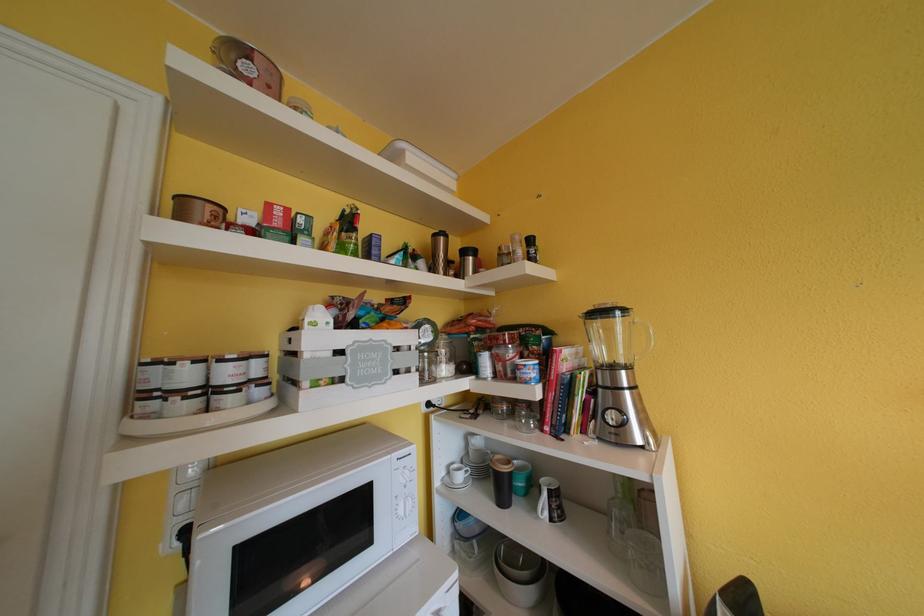
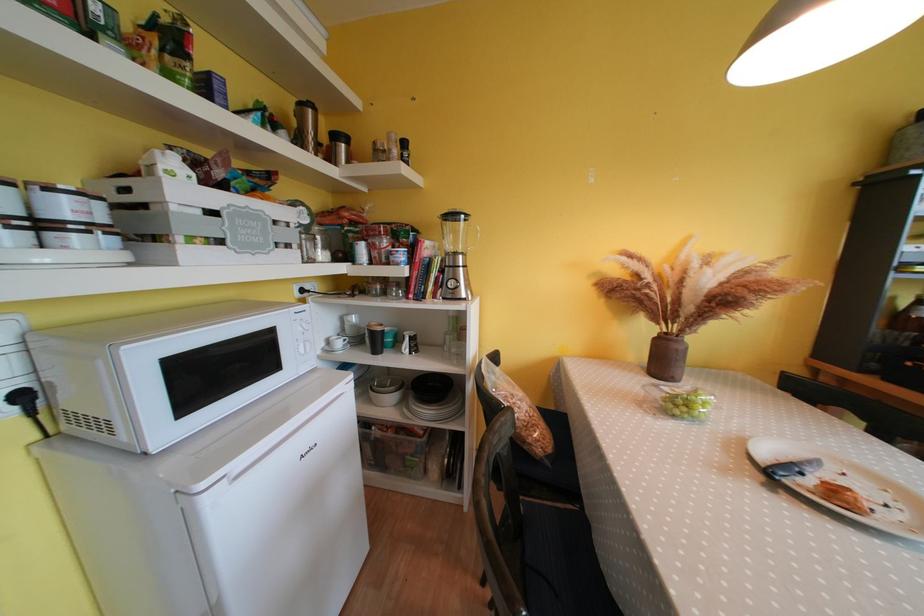
Where in the second image is the point corresponding to [469,256] from the first image?

(342, 140)